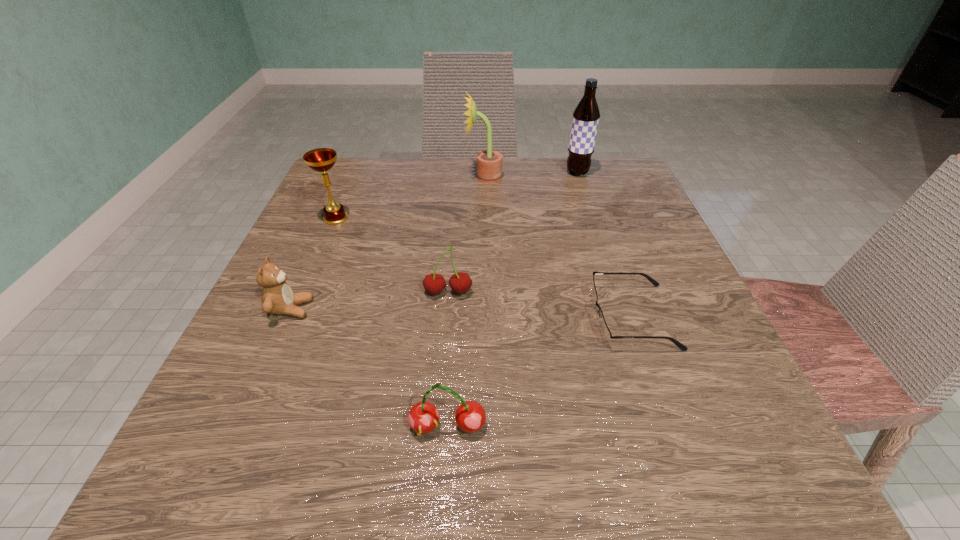
This screenshot has height=540, width=960. In order to click on chalice present at the far edge in this screenshot , I will do pos(321,159).

At what (x,y) coordinates should I click in order to perform the action: click on object located in the near edge section of the desktop. Please return your answer as a coordinate pair (x, y). The width and height of the screenshot is (960, 540). Looking at the image, I should click on (470, 416).

I want to click on chalice situated at the left edge, so click(321, 159).

What are the coordinates of `teddy bear present at the left edge` in the screenshot? It's located at (277, 296).

You are a GUI agent. You are given a task and a screenshot of the screen. Output one action in this format:
    pyautogui.click(x=<x>, y=<y>)
    Task: Click on the root beer at the right edge
    Image resolution: width=960 pixels, height=540 pixels.
    Given the screenshot: What is the action you would take?
    pyautogui.click(x=586, y=115)

Locate an element on the screen. This screenshot has width=960, height=540. spectacles present at the right edge is located at coordinates (606, 335).

The width and height of the screenshot is (960, 540). I want to click on object present at the far left corner, so [321, 159].

Locate an element on the screen. This screenshot has width=960, height=540. object at the far right corner is located at coordinates (586, 115).

I want to click on free space at the far edge of the desktop, so click(425, 190).

Where is `vacant space at the left edge of the desktop`? This screenshot has width=960, height=540. vacant space at the left edge of the desktop is located at coordinates (359, 289).